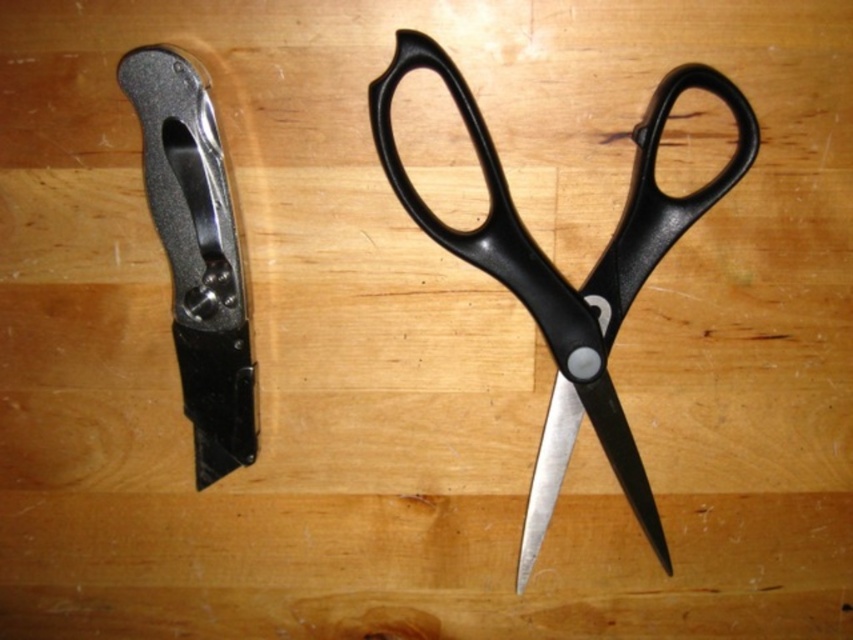
You are organizing a tool drawer and need to place the black plastic scissors at center and the brushed metal utility knife at upper left. If the drawer has a compartment that can only fit items smaller than the utility knife, which tool should you place there?

The brushed metal utility knife at upper left should be placed in the compartment since the black plastic scissors at center are larger in size, making the utility knife the smaller tool that fits the compartment.

You are organizing a tool kit and need to stack the black plastic scissors at center and the brushed metal utility knife at upper left vertically. Which tool should you place at the bottom of the stack to ensure stability?

The black plastic scissors at center is much taller than the brushed metal utility knife at upper left. To ensure stability, place the taller black plastic scissors at center at the bottom of the stack since it has a larger base area.

In the scene shown: You are standing at the center of the wooden surface where the utility knife and scissors are placed. If you want to reach both points labeled as point [384,99] and point [524,518], which point would you reach first?

Point [384,99] is in front of point [524,518], so you would reach point [384,99] first.